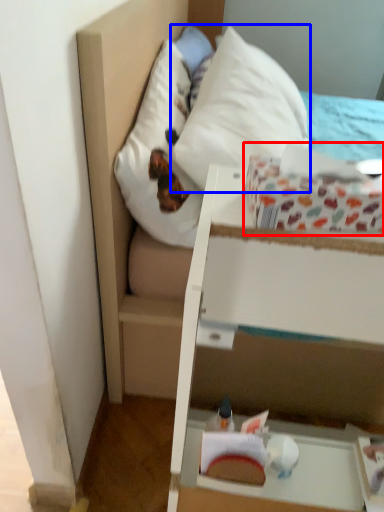
Question: Which object is closer to the camera taking this photo, cardboard box (highlighted by a red box) or pillow (highlighted by a blue box)?

Choices:
 (A) cardboard box
 (B) pillow

Answer: (A)